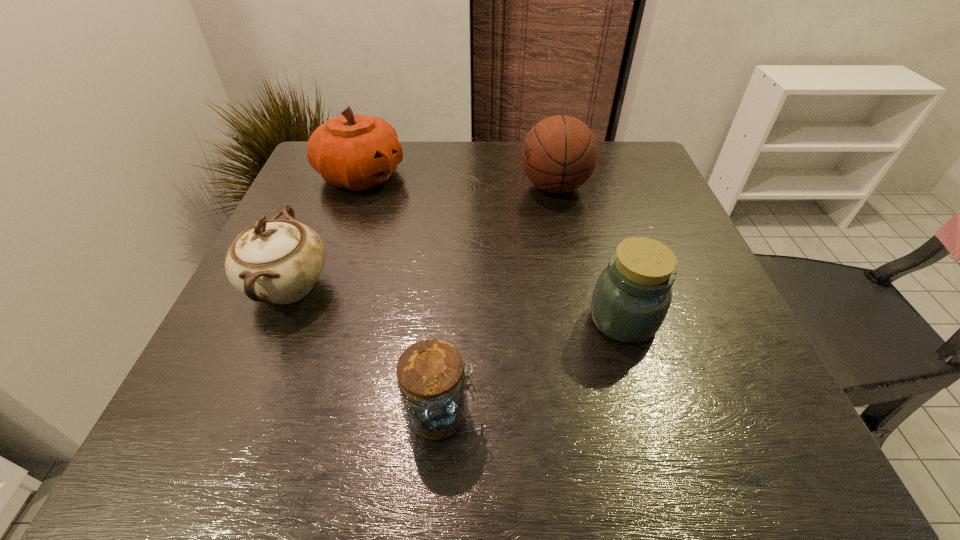
Image resolution: width=960 pixels, height=540 pixels. What are the coordinates of `free region located 0.370m on the side with brand label of the basketball` in the screenshot? It's located at (371, 187).

Image resolution: width=960 pixels, height=540 pixels. What are the coordinates of `vacant point located on the back of the chinaware` in the screenshot? It's located at (324, 201).

The height and width of the screenshot is (540, 960). I want to click on free space located on the back of the right jar, so click(x=596, y=228).

I want to click on vacant space positioned 0.340m on the lid of the nearest object, so click(700, 414).

Identify the location of pumpkin present at the far edge. (353, 151).

This screenshot has height=540, width=960. Find the location of `basketball that is positioned at the far edge`. basketball that is positioned at the far edge is located at coordinates (559, 154).

Where is `object located at the near edge`? Image resolution: width=960 pixels, height=540 pixels. object located at the near edge is located at coordinates (432, 383).

Locate an element on the screen. The height and width of the screenshot is (540, 960). pumpkin present at the left edge is located at coordinates (353, 151).

Locate an element on the screen. chinaware positioned at the left edge is located at coordinates (278, 261).

Where is `object present at the right edge`? The width and height of the screenshot is (960, 540). object present at the right edge is located at coordinates (632, 296).